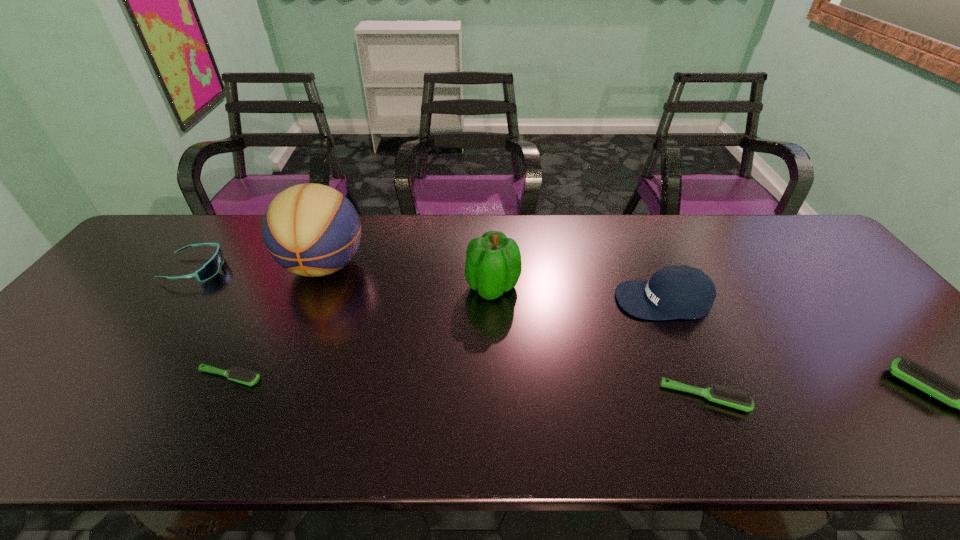
Where is `the shortest hairbrush`? The height and width of the screenshot is (540, 960). the shortest hairbrush is located at coordinates (248, 377).

Locate an element on the screen. The height and width of the screenshot is (540, 960). the leftmost hairbrush is located at coordinates (248, 377).

Identify the location of the second tallest hairbrush. point(720,394).

Locate an element on the screen. This screenshot has height=540, width=960. the second shortest object is located at coordinates (720, 394).

Where is `the leftmost object`? This screenshot has height=540, width=960. the leftmost object is located at coordinates (211, 268).

Where is `the second tallest object`? The image size is (960, 540). the second tallest object is located at coordinates (493, 266).

I want to click on bell pepper, so click(x=493, y=266).

Where is `basketball`? basketball is located at coordinates (312, 230).

Find the location of `the fifth shortest object`. the fifth shortest object is located at coordinates (679, 291).

The height and width of the screenshot is (540, 960). In order to click on vacant region located 0.230m on the left of the leftmost hairbrush in this screenshot , I will do `click(97, 377)`.